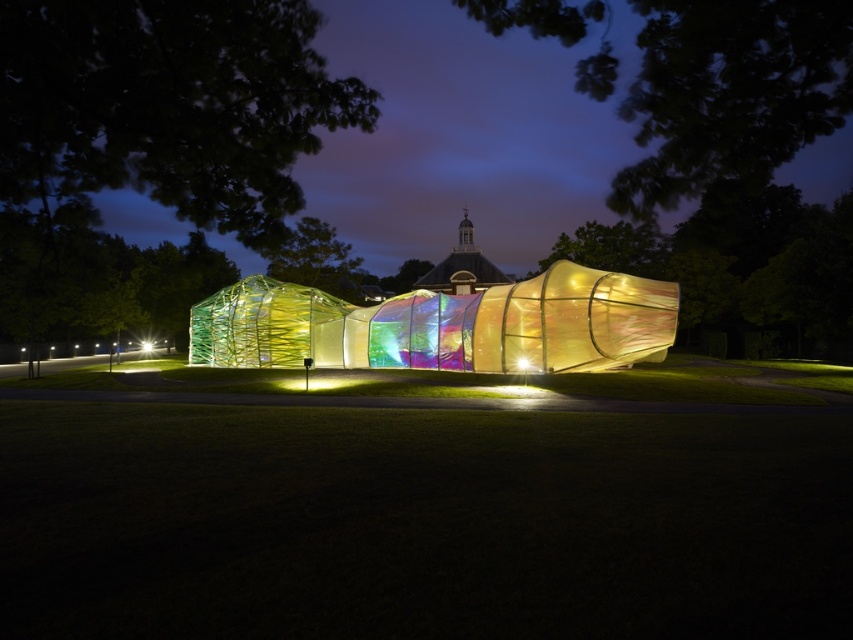
Question: Considering the relative positions of iridescent fabric tent at center and transparent fabric at center in the image provided, where is iridescent fabric tent at center located with respect to transparent fabric at center?

Choices:
 (A) above
 (B) below

Answer: (A)

Question: Can you confirm if iridescent fabric tent at center is wider than transparent fabric at center?

Choices:
 (A) no
 (B) yes

Answer: (B)

Question: From the image, what is the correct spatial relationship of iridescent fabric tent at center in relation to transparent fabric at center?

Choices:
 (A) right
 (B) left

Answer: (B)

Question: Which of the following is the farthest from the observer?

Choices:
 (A) (605, 305)
 (B) (526, 362)

Answer: (B)